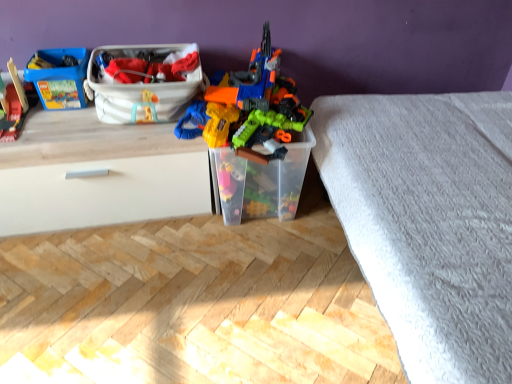
Find the location of a particular element. free space that is in between wooden train at left, the 2th toy in the right-to-left sequence, and matte plastic lego box at upper left, which appears as the third storage box when viewed from the right is located at coordinates tap(59, 117).